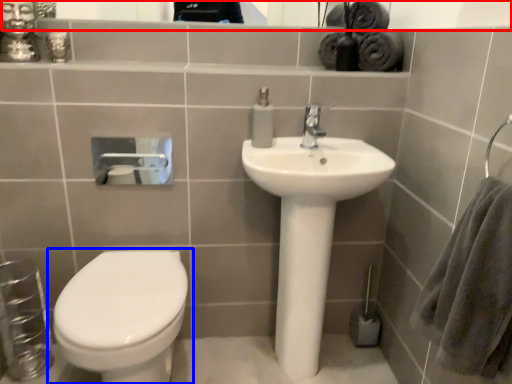
Question: Among these objects, which one is nearest to the camera, mirror (highlighted by a red box) or toilet (highlighted by a blue box)?

Choices:
 (A) mirror
 (B) toilet

Answer: (B)